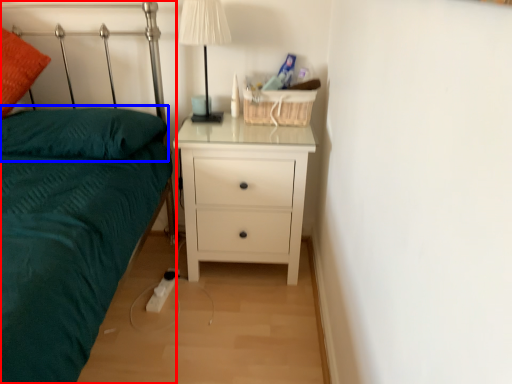
Question: Which object is further to the camera taking this photo, bed (highlighted by a red box) or pillow (highlighted by a blue box)?

Choices:
 (A) bed
 (B) pillow

Answer: (B)